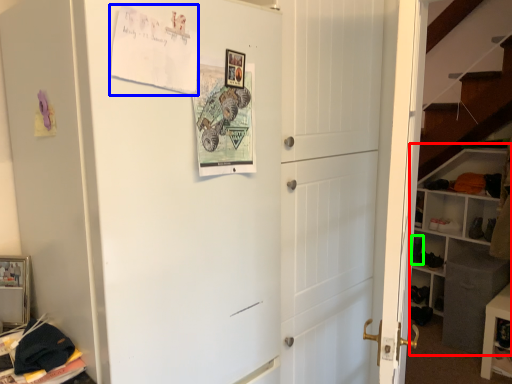
Question: Which object is positioned closest to bookshelf (highlighted by a red box)? Select from postcard (highlighted by a blue box) and shoe (highlighted by a green box).

Choices:
 (A) postcard
 (B) shoe

Answer: (B)